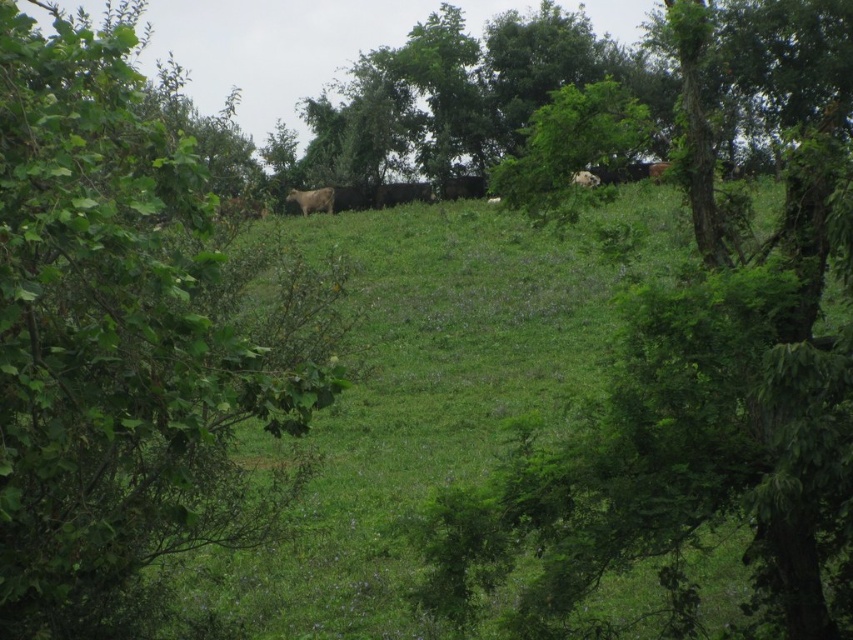
Is point (73, 266) positioned in front of point (583, 176)?

Yes.

Who is more forward, (51, 481) or (577, 180)?

Point (51, 481) is in front.

Between point (61, 282) and point (596, 176), which one is positioned behind?

The point (596, 176) is more distant.

You are a GUI agent. You are given a task and a screenshot of the screen. Output one action in this format:
    pyautogui.click(x=<x>, y=<y>)
    Task: Click on the green leafy tree at left
    The width and height of the screenshot is (853, 640).
    Given the screenshot: What is the action you would take?
    pyautogui.click(x=119, y=340)

Who is positioned more to the left, green leafy tree at center or white woolly sheep at center?

Positioned to the left is white woolly sheep at center.

How distant is green leafy tree at center from white woolly sheep at center?

green leafy tree at center and white woolly sheep at center are 20.03 meters apart.

The width and height of the screenshot is (853, 640). I want to click on green leafy tree at center, so click(x=700, y=376).

The height and width of the screenshot is (640, 853). I want to click on green leafy tree at center, so click(700, 376).

Does green leafy tree at center have a lesser height compared to white fur at upper center?

No.

Does point (693, 406) come closer to viewer compared to point (582, 180)?

Yes, it is in front of point (582, 180).

Locate an element on the screen. The height and width of the screenshot is (640, 853). green leafy tree at center is located at coordinates (700, 376).